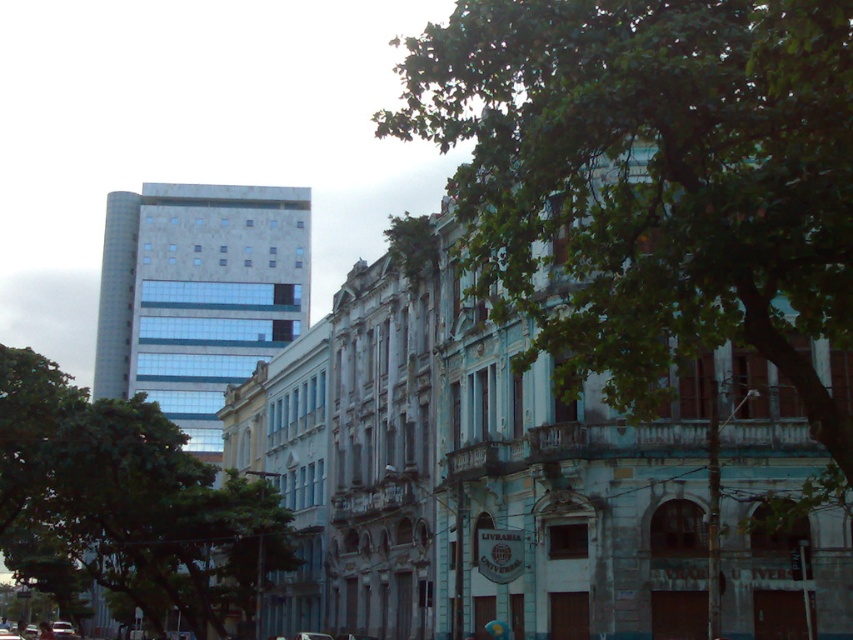
You are standing at the point with coordinates point (59, 625) and want to walk to the point with coordinates point (704, 307). Is the point you are walking to closer to the modern highrise building on the left or the classical buildings on the right?

The point you are walking to, point (704, 307), is closer to the modern highrise building on the left because it is located on the left side of the image.

You are a city planner assessing the spacing between two green leafy trees in an urban area. The city requires that trees must be at least 150 feet apart to ensure adequate space for growth. Based on the image, do the green leafy tree at center and the green leafy tree at left meet this requirement?

The green leafy tree at center and the green leafy tree at left are 143.57 feet apart. Since this distance is less than the required 150 feet, they do not meet the spacing requirement.

You are standing in the urban area shown in the image. There is a point marked at coordinates (125, 502). What object is located at this point?

The point at coordinates (125, 502) marks a green leafy tree at left.